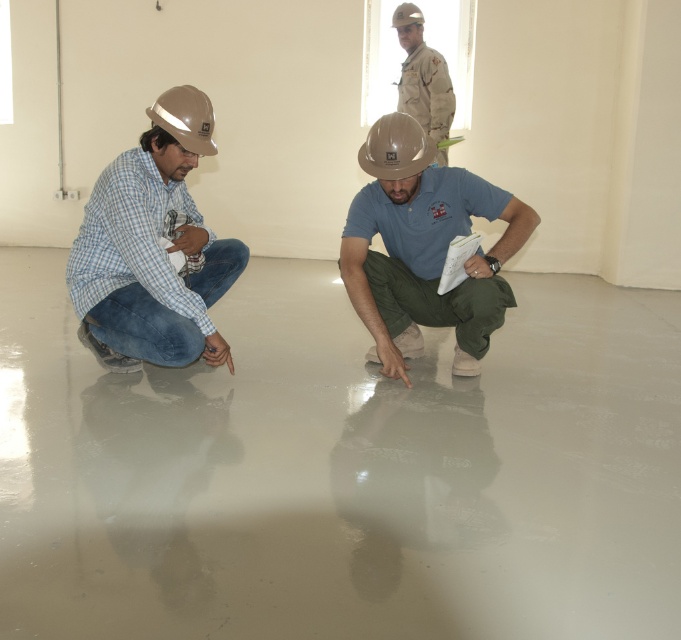
Is smooth concrete floor at center wider than matte brown helmet at center?

Yes, smooth concrete floor at center is wider than matte brown helmet at center.

Does point (285, 380) lie behind point (417, 128)?

Yes.

This screenshot has height=640, width=681. Describe the element at coordinates (343, 470) in the screenshot. I see `smooth concrete floor at center` at that location.

Where is `smooth concrete floor at center`? smooth concrete floor at center is located at coordinates (343, 470).

Who is higher up, matte beige hard hat at upper left or matte beige helmet at upper center?

matte beige helmet at upper center

The image size is (681, 640). Find the location of `matte beige hard hat at upper left`. matte beige hard hat at upper left is located at coordinates (185, 116).

Between matte blue shirt at left and matte brown helmet at center, which one has less height?

matte brown helmet at center is shorter.

Describe the element at coordinates (153, 248) in the screenshot. The width and height of the screenshot is (681, 640). I see `matte blue shirt at left` at that location.

Is point (95, 236) positioned behind point (409, 160)?

That is True.

You are a GUI agent. You are given a task and a screenshot of the screen. Output one action in this format:
    pyautogui.click(x=<x>, y=<y>)
    Task: Click on the matte blue shirt at left
    
    Given the screenshot: What is the action you would take?
    pyautogui.click(x=153, y=248)